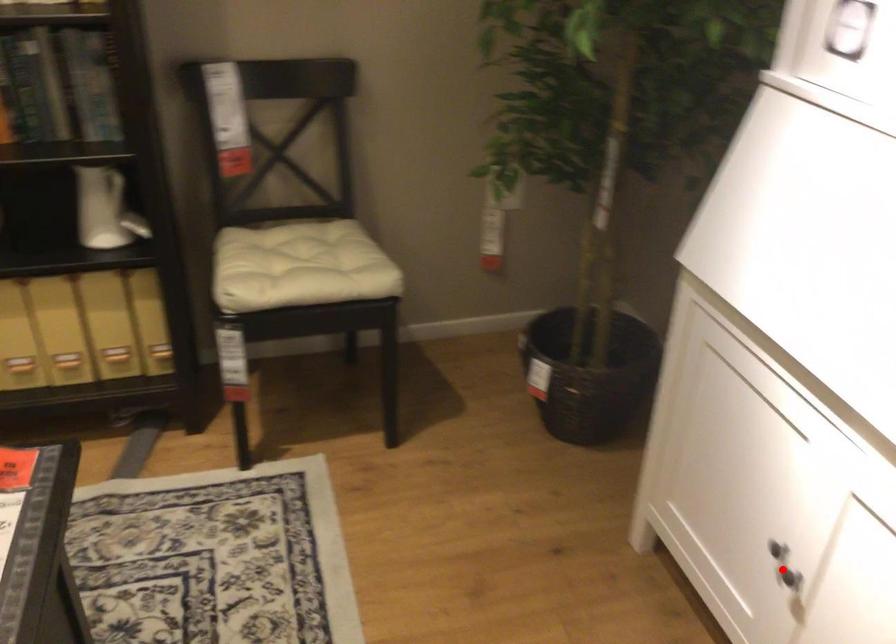
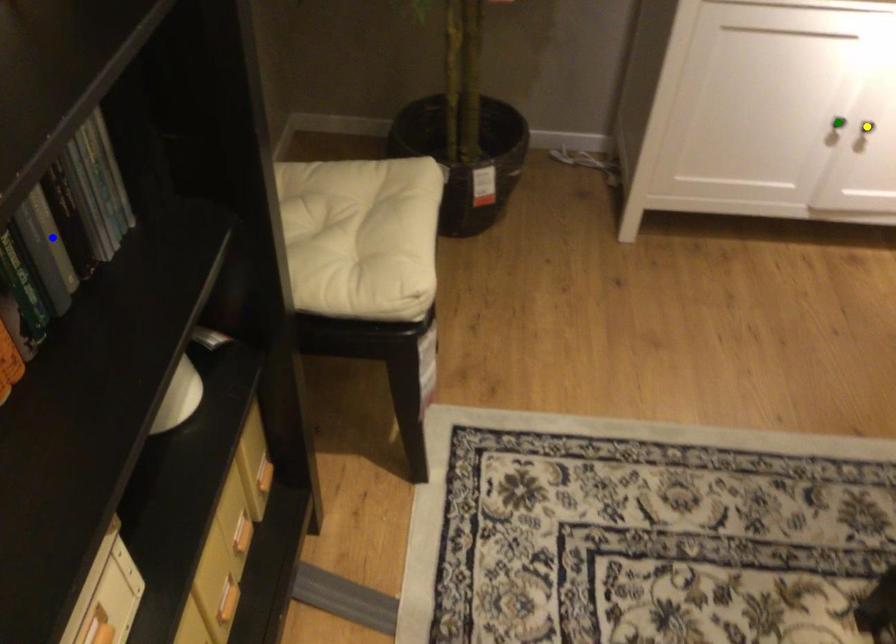
Question: I am providing you with two images of the same scene from different viewpoints. A red point is marked on the first image. You are given multiple points on the second image. Which spot in image 2 lines up with the point in image 1?

Choices:
 (A) yellow point
 (B) green point
 (C) blue point

Answer: (A)